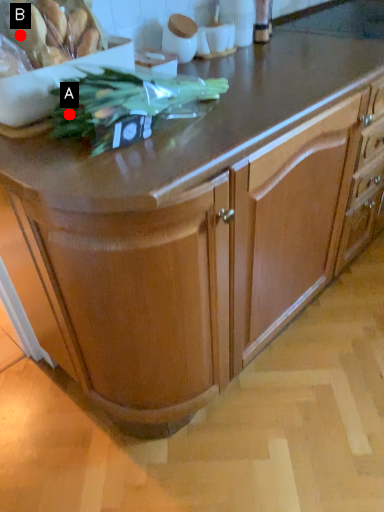
Question: Two points are circled on the image, labeled by A and B beside each circle. Which point is further to the camera?

Choices:
 (A) A is further
 (B) B is further

Answer: (B)